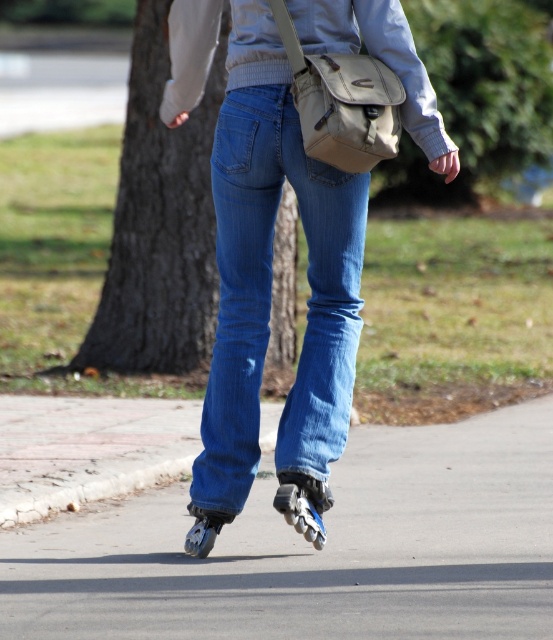
You are taking a photo of the person rollerblading and want to focus on both the point at point (225, 243) and point (283, 474). Which point should you adjust your focus to first to ensure it is closer to the camera?

Point (225, 243) is further to the camera than point (283, 474), so you should adjust your focus to point (225, 243) first to ensure it is closer to the camera.

You are a photographer trying to capture a clear shot of the black rubber roller skate at center. However, the denim at center is covering part of it. Can you suggest a way to adjust the person to get a better view of the skate?

The denim at center is positioned over the black rubber roller skate at center, so to get a better view of the skate, the person should adjust their position so that the denim at center moves away from the skate.